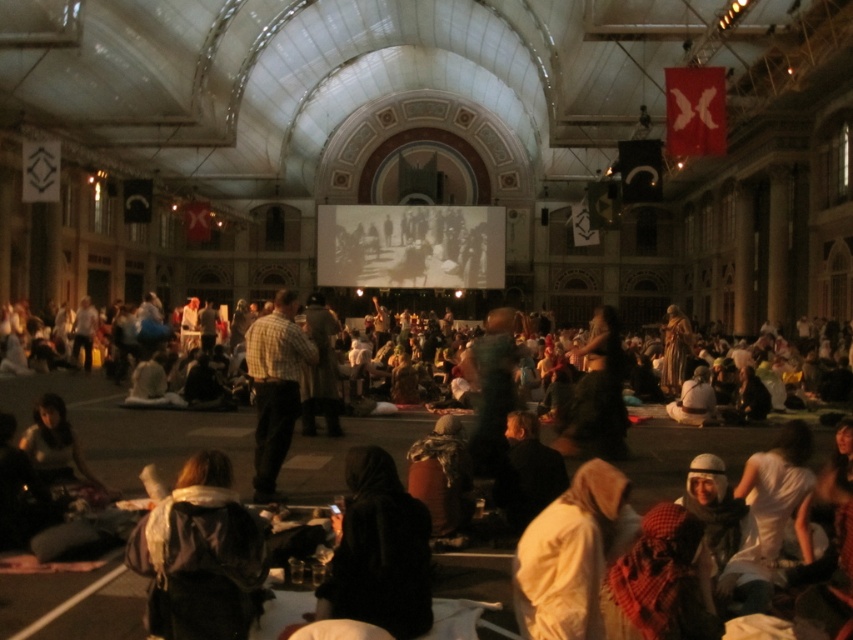
Question: Among these points, which one is nearest to the camera?

Choices:
 (A) (376, 538)
 (B) (256, 460)
 (C) (567, 579)

Answer: (C)

Question: Which object is positioned closest to the checkered fabric shirt at center?

Choices:
 (A) light beige fabric at lower right
 (B) dark brown leather jacket at lower left
 (C) black matte hood at center

Answer: (B)

Question: Can you confirm if black matte hood at center is positioned below light beige fabric at lower right?

Choices:
 (A) no
 (B) yes

Answer: (B)

Question: Which object appears closest to the camera in this image?

Choices:
 (A) dark brown leather jacket at lower left
 (B) black matte hood at center
 (C) light beige fabric at lower right
 (D) checkered fabric shirt at center

Answer: (A)

Question: Is black matte hood at center to the left of checkered fabric shirt at center from the viewer's perspective?

Choices:
 (A) no
 (B) yes

Answer: (A)

Question: Does light beige fabric at lower right have a greater width compared to checkered fabric shirt at center?

Choices:
 (A) yes
 (B) no

Answer: (B)